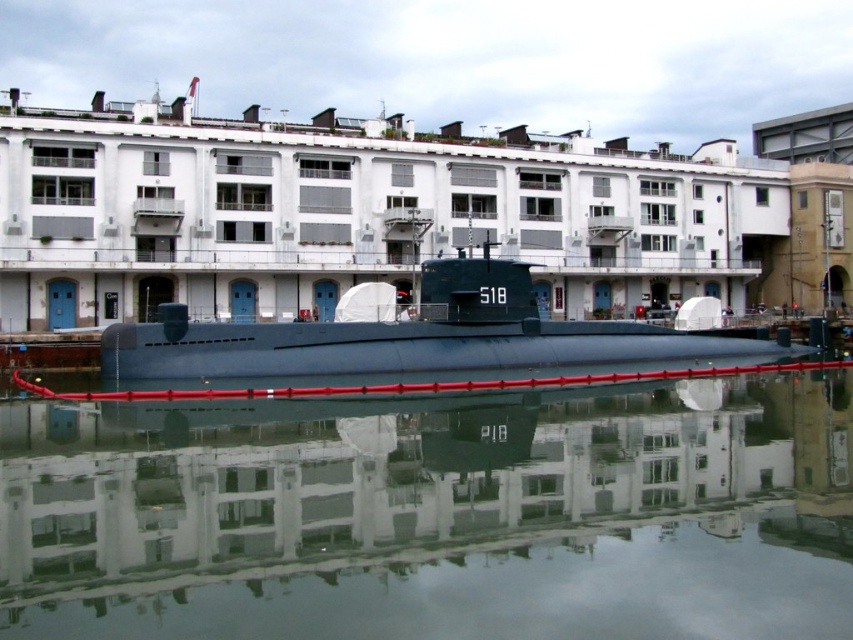
Who is higher up, transparent glass water at center or matte black submarine at center?

matte black submarine at center is above.

Can you confirm if transparent glass water at center is positioned above matte black submarine at center?

Incorrect, transparent glass water at center is not positioned above matte black submarine at center.

Who is more forward, (721, 548) or (426, 369)?

Point (721, 548)

Find the location of a particular element. The height and width of the screenshot is (640, 853). transparent glass water at center is located at coordinates (437, 516).